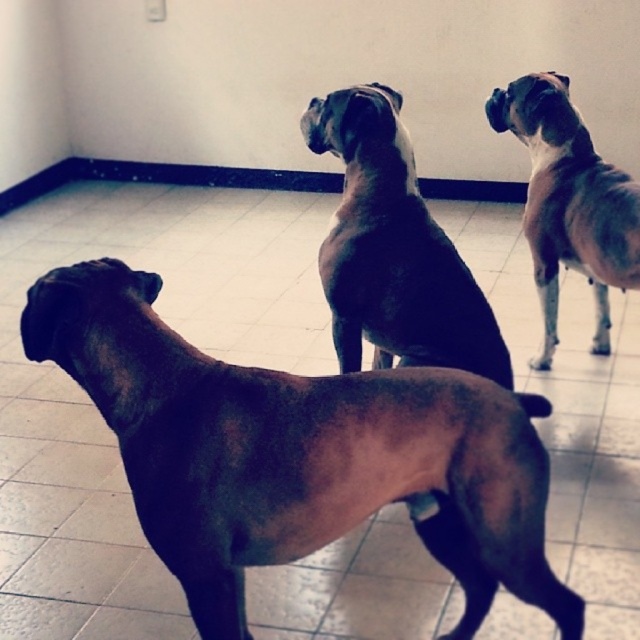
You are a dog trainer observing three Boxer dogs in a room. You notice two dogs labeled as brown matte dog at center and brown fur dog at center. Which of these two dogs is positioned lower in the image?

The brown matte dog at center is positioned lower than the brown fur dog at center in the image.

You are a dog trainer observing three Boxer dogs in a room. You notice the brown matte dog at center and the brown smooth coat at upper right. Which dog is shorter in height?

The brown matte dog at center is shorter in height than the brown smooth coat at upper right.

Based on the scene description, where is the brown matte dog at center located in terms of coordinates?

The brown matte dog at center is located at coordinates point (298,452).